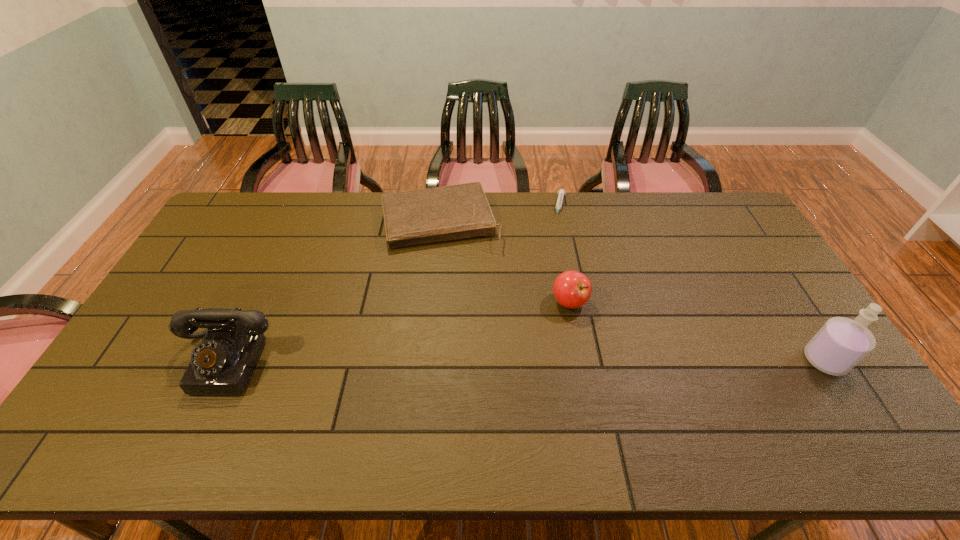
Find the location of a particular element. paperback book that is positioned at the far edge is located at coordinates (414, 217).

The height and width of the screenshot is (540, 960). I want to click on object present at the near edge, so click(222, 363).

At what (x,y) coordinates should I click in order to perform the action: click on object at the left edge. Please return your answer as a coordinate pair (x, y). The width and height of the screenshot is (960, 540). Looking at the image, I should click on (222, 363).

At what (x,y) coordinates should I click in order to perform the action: click on object that is at the right edge. Please return your answer as a coordinate pair (x, y). This screenshot has height=540, width=960. Looking at the image, I should click on (841, 343).

The height and width of the screenshot is (540, 960). What are the coordinates of `object situated at the near left corner` in the screenshot? It's located at click(x=222, y=363).

Locate an element on the screen. This screenshot has width=960, height=540. free space at the far edge is located at coordinates (345, 215).

The height and width of the screenshot is (540, 960). In the image, there is a desktop. What are the coordinates of `vacant space at the near edge` in the screenshot? It's located at (687, 398).

Find the location of `vacant region at the left edge of the desktop`. vacant region at the left edge of the desktop is located at coordinates (177, 377).

The image size is (960, 540). Identify the location of vacant area at the far left corner of the desktop. (233, 218).

In order to click on vacant area between the fourth shortest object and the syringe in this screenshot , I will do `click(394, 284)`.